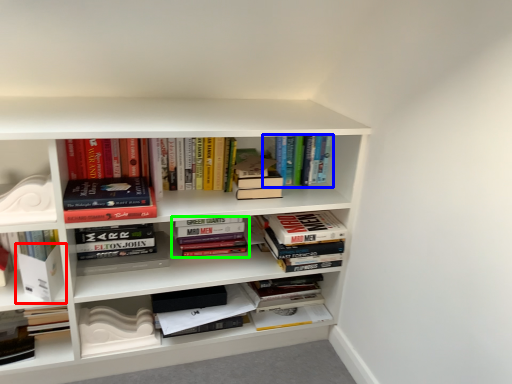
Question: Estimate the real-world distances between objects in this image. Which object is farther from paperback book (highlighted by a red box), book (highlighted by a blue box) or book (highlighted by a green box)?

Choices:
 (A) book
 (B) book

Answer: (A)